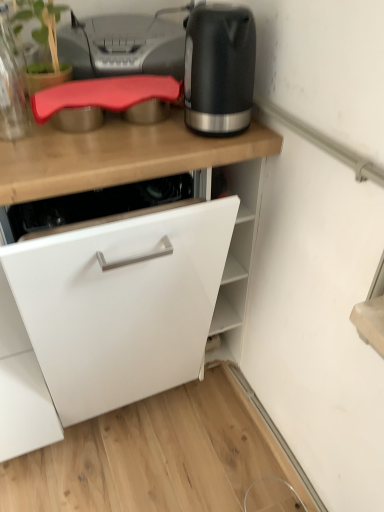
Describe the element at coordinates (126, 159) in the screenshot. I see `white matte cabinet at center` at that location.

The image size is (384, 512). Describe the element at coordinates (219, 69) in the screenshot. I see `matte black kettle at upper right` at that location.

Describe the element at coordinates (11, 85) in the screenshot. The width and height of the screenshot is (384, 512). I see `translucent glass jar at upper left` at that location.

Locate an element on the screen. The width and height of the screenshot is (384, 512). white matte cabinet at center is located at coordinates (126, 159).

How far apart are matte gray printer at upper center and translucent glass jar at upper left?

matte gray printer at upper center is 9.29 inches from translucent glass jar at upper left.

Can you confirm if matte gray printer at upper center is positioned to the left of translucent glass jar at upper left?

No, matte gray printer at upper center is not to the left of translucent glass jar at upper left.

Based on the photo, is matte gray printer at upper center facing towards translucent glass jar at upper left?

No, matte gray printer at upper center is not facing towards translucent glass jar at upper left.

Is matte gray printer at upper center with translucent glass jar at upper left?

No, matte gray printer at upper center is not next to translucent glass jar at upper left.

Is white matte cabinet at center a part of matte gray printer at upper center?

That's incorrect, white matte cabinet at center is not inside matte gray printer at upper center.

From the image's perspective, does matte gray printer at upper center appear higher than white matte cabinet at center?

Correct, matte gray printer at upper center appears higher than white matte cabinet at center in the image.

Between matte gray printer at upper center and white matte cabinet at center, which one appears on the right side from the viewer's perspective?

matte gray printer at upper center.

Is matte gray printer at upper center facing away from white matte cabinet at center?

No.

Locate an element on the screen. This screenshot has height=512, width=384. home appliance in front of the matte gray printer at upper center is located at coordinates (219, 69).

From the image's perspective, which one is positioned higher, matte gray printer at upper center or matte black kettle at upper right?

matte gray printer at upper center.

Is matte gray printer at upper center oriented towards matte black kettle at upper right?

Yes.

Is matte gray printer at upper center positioned far away from matte black kettle at upper right?

No, matte gray printer at upper center is in close proximity to matte black kettle at upper right.

Is point (23, 151) closer to camera compared to point (192, 15)?

No, it is behind (192, 15).

Between white matte cabinet at center and matte black kettle at upper right, which one is positioned behind?

matte black kettle at upper right is further away from the camera.

From the picture: From the image's perspective, between white matte cabinet at center and matte black kettle at upper right, who is located below?

white matte cabinet at center, from the image's perspective.

From a real-world perspective, is translucent glass jar at upper left physically located above or below matte black kettle at upper right?

translucent glass jar at upper left is situated lower than matte black kettle at upper right in the real world.

Are translucent glass jar at upper left and matte black kettle at upper right far apart?

No, translucent glass jar at upper left is not far from matte black kettle at upper right.

Can we say translucent glass jar at upper left lies outside matte black kettle at upper right?

Absolutely, translucent glass jar at upper left is external to matte black kettle at upper right.

Looking at this image, does translucent glass jar at upper left have a smaller size compared to matte gray printer at upper center?

Yes.

From the image's perspective, is translucent glass jar at upper left located above matte gray printer at upper center?

Incorrect, from the image's perspective, translucent glass jar at upper left is lower than matte gray printer at upper center.

Is translucent glass jar at upper left facing away from matte gray printer at upper center?

No, matte gray printer at upper center is not at the back of translucent glass jar at upper left.

Is white matte cabinet at center thinner than matte gray printer at upper center?

Incorrect, the width of white matte cabinet at center is not less than that of matte gray printer at upper center.

Is white matte cabinet at center in contact with matte gray printer at upper center?

No, white matte cabinet at center is not next to matte gray printer at upper center.

Does white matte cabinet at center contain matte gray printer at upper center?

No, matte gray printer at upper center is not a part of white matte cabinet at center.

Can you confirm if white matte cabinet at center is taller than matte gray printer at upper center?

Correct, white matte cabinet at center is much taller as matte gray printer at upper center.

This screenshot has height=512, width=384. Identify the location of kitchen appliance above the matte gray printer at upper center (from a real-world perspective). (11, 85).

At what (x,y) coordinates should I click in order to perform the action: click on cabinetry below the matte gray printer at upper center (from the image's perspective). Please return your answer as a coordinate pair (x, y). Image resolution: width=384 pixels, height=512 pixels. Looking at the image, I should click on (126, 159).

When comparing their distances from matte gray printer at upper center, does matte black kettle at upper right or white matte cabinet at center seem closer?

Based on the image, white matte cabinet at center appears to be nearer to matte gray printer at upper center.

From the image, which object appears to be nearer to matte gray printer at upper center, translucent glass jar at upper left or matte black kettle at upper right?

translucent glass jar at upper left is positioned closer to the anchor matte gray printer at upper center.

Which object lies further to the anchor point matte gray printer at upper center, matte black kettle at upper right or translucent glass jar at upper left?

matte black kettle at upper right.

Looking at the image, which one is located closer to translucent glass jar at upper left, matte black kettle at upper right or matte gray printer at upper center?

matte gray printer at upper center.

Looking at this image, considering their positions, is white matte cabinet at center positioned closer to matte black kettle at upper right than translucent glass jar at upper left?

white matte cabinet at center is closer to matte black kettle at upper right.

Which object lies further to the anchor point matte gray printer at upper center, translucent glass jar at upper left or white matte cabinet at center?

Based on the image, white matte cabinet at center appears to be further to matte gray printer at upper center.

Based on the photo, looking at the image, which one is located further to white matte cabinet at center, matte black kettle at upper right or matte gray printer at upper center?

matte gray printer at upper center.

Based on their spatial positions, is translucent glass jar at upper left or white matte cabinet at center closer to matte black kettle at upper right?

The object closer to matte black kettle at upper right is white matte cabinet at center.

Locate an element on the screen. The image size is (384, 512). home appliance between translucent glass jar at upper left and white matte cabinet at center vertically is located at coordinates (219, 69).

The height and width of the screenshot is (512, 384). In order to click on kitchen appliance between matte gray printer at upper center and white matte cabinet at center vertically in this screenshot , I will do `click(11, 85)`.

The height and width of the screenshot is (512, 384). Identify the location of home appliance between matte gray printer at upper center and white matte cabinet at center in the vertical direction. (219, 69).

Where is `printer between translucent glass jar at upper left and matte black kettle at upper right from left to right`? This screenshot has height=512, width=384. printer between translucent glass jar at upper left and matte black kettle at upper right from left to right is located at coordinates (122, 46).